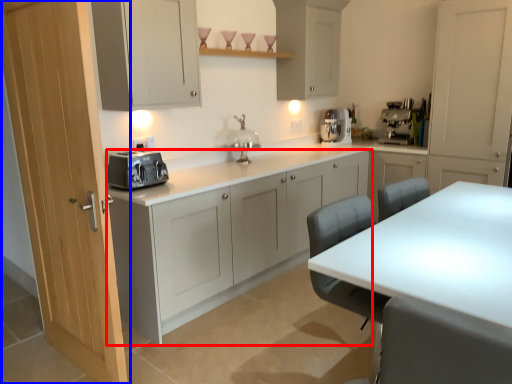
Question: Which of the following is the closest to the observer, cabinetry (highlighted by a red box) or door (highlighted by a blue box)?

Choices:
 (A) cabinetry
 (B) door

Answer: (B)